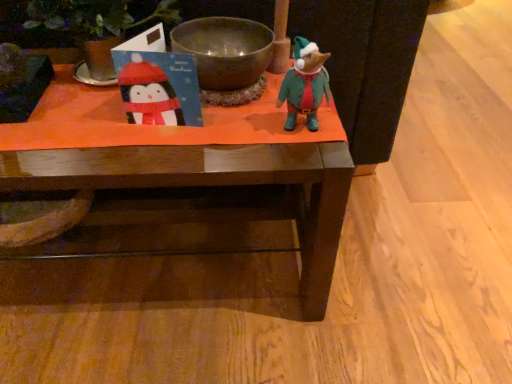
At what (x,y) coordinates should I click in order to perform the action: click on vacant space in front of green felt mouse at center. Please return your answer as a coordinate pair (x, y). Looking at the image, I should click on (300, 158).